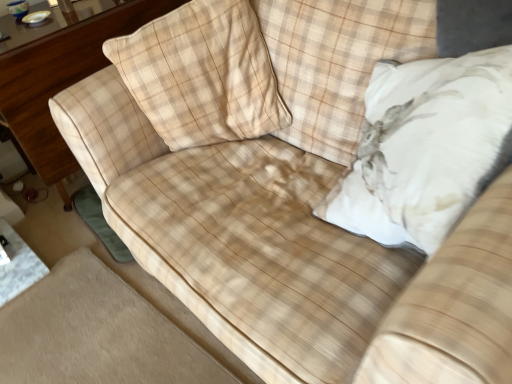
Question: Should I look upward or downward to see white plush pillow at upper right, marked as the 1th throw pillow in a right-to-left arrangement?

Choices:
 (A) up
 (B) down

Answer: (A)

Question: Could beige plaid pillow at upper left, marked as the 2th throw pillow in a right-to-left arrangement, be considered to be inside white plush pillow at upper right, marked as the 1th throw pillow in a right-to-left arrangement?

Choices:
 (A) yes
 (B) no

Answer: (B)

Question: Would you say white plush pillow at upper right, marked as the 1th throw pillow in a right-to-left arrangement, is outside beige plaid pillow at upper left, the first throw pillow in the left-to-right sequence?

Choices:
 (A) no
 (B) yes

Answer: (B)

Question: Is white plush pillow at upper right, which is the second throw pillow in left-to-right order, positioned before beige plaid pillow at upper left, marked as the 2th throw pillow in a right-to-left arrangement?

Choices:
 (A) yes
 (B) no

Answer: (A)

Question: Considering the relative sizes of white plush pillow at upper right, marked as the 1th throw pillow in a right-to-left arrangement, and beige plaid pillow at upper left, marked as the 2th throw pillow in a right-to-left arrangement, in the image provided, is white plush pillow at upper right, marked as the 1th throw pillow in a right-to-left arrangement, smaller than beige plaid pillow at upper left, marked as the 2th throw pillow in a right-to-left arrangement,?

Choices:
 (A) no
 (B) yes

Answer: (A)

Question: Does white plush pillow at upper right, which is the second throw pillow in left-to-right order, lie behind beige plaid pillow at upper left, marked as the 2th throw pillow in a right-to-left arrangement?

Choices:
 (A) yes
 (B) no

Answer: (B)

Question: From the image's perspective, is white plush pillow at upper right, marked as the 1th throw pillow in a right-to-left arrangement, beneath beige plaid pillow at upper left, marked as the 2th throw pillow in a right-to-left arrangement?

Choices:
 (A) no
 (B) yes

Answer: (B)

Question: Could you tell me if wooden dresser at left is turned towards beige plaid pillow at upper left, marked as the 2th throw pillow in a right-to-left arrangement?

Choices:
 (A) no
 (B) yes

Answer: (B)

Question: Considering the relative sizes of wooden dresser at left and beige plaid pillow at upper left, marked as the 2th throw pillow in a right-to-left arrangement, in the image provided, is wooden dresser at left wider than beige plaid pillow at upper left, marked as the 2th throw pillow in a right-to-left arrangement,?

Choices:
 (A) yes
 (B) no

Answer: (A)

Question: From a real-world perspective, does wooden dresser at left sit lower than beige plaid pillow at upper left, marked as the 2th throw pillow in a right-to-left arrangement?

Choices:
 (A) no
 (B) yes

Answer: (B)

Question: Does wooden dresser at left have a larger size compared to beige plaid pillow at upper left, marked as the 2th throw pillow in a right-to-left arrangement?

Choices:
 (A) no
 (B) yes

Answer: (B)

Question: Does wooden dresser at left have a greater height compared to beige plaid pillow at upper left, marked as the 2th throw pillow in a right-to-left arrangement?

Choices:
 (A) no
 (B) yes

Answer: (B)

Question: Is wooden dresser at left behind beige plaid pillow at upper left, marked as the 2th throw pillow in a right-to-left arrangement?

Choices:
 (A) yes
 (B) no

Answer: (A)

Question: Is beige plaid pillow at upper left, marked as the 2th throw pillow in a right-to-left arrangement, outside white plush pillow at upper right, marked as the 1th throw pillow in a right-to-left arrangement?

Choices:
 (A) yes
 (B) no

Answer: (A)